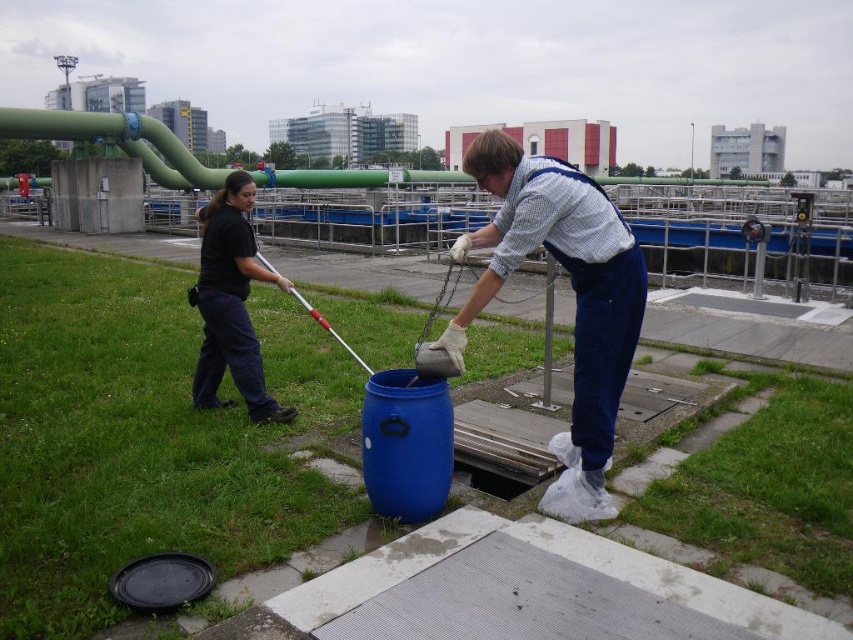
Between blue denim overalls at center and black fabric pants at left, which one has less height?

blue denim overalls at center is shorter.

Does point (590, 209) come closer to viewer compared to point (213, 330)?

That is True.

Is point (589, 364) farther from camera compared to point (256, 371)?

No.

Locate an element on the screen. This screenshot has width=853, height=640. blue denim overalls at center is located at coordinates (573, 296).